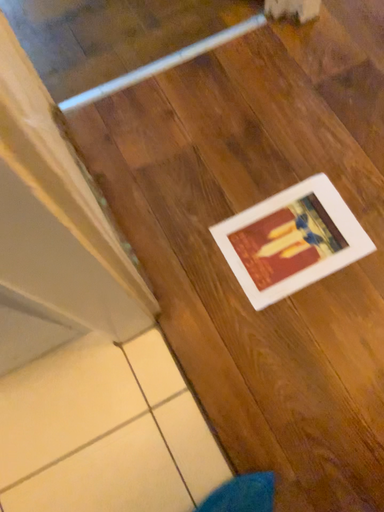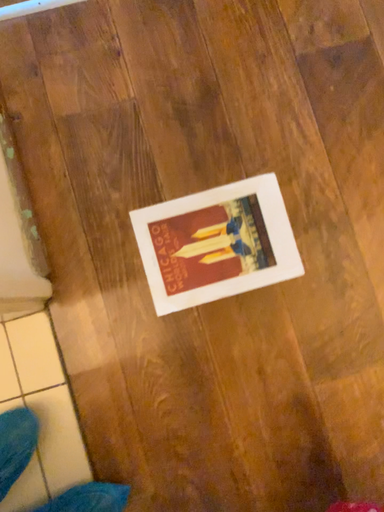
Question: How did the camera likely rotate when shooting the video?

Choices:
 (A) rotated upward
 (B) rotated downward

Answer: (B)